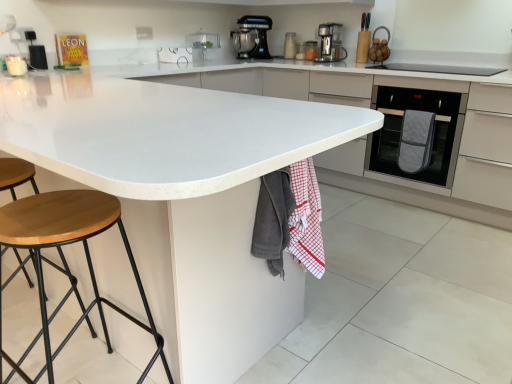
What do you see at coordinates (379, 47) in the screenshot?
I see `wooden fruit basket at upper right, the third appliance from the back` at bounding box center [379, 47].

Where is `black plastic speaker at upper left, the fourth appliance when ordered from right to left`? The image size is (512, 384). black plastic speaker at upper left, the fourth appliance when ordered from right to left is located at coordinates (38, 57).

You are a GUI agent. You are given a task and a screenshot of the screen. Output one action in this format:
    pyautogui.click(x=<x>, y=<y>)
    Task: Click on the wooden fruit basket at upper right, the third appliance from the back
    This screenshot has width=512, height=384.
    Given the screenshot: What is the action you would take?
    pyautogui.click(x=379, y=47)

Is matte white oven at right with matte glass jars at upper center, marked as the second appliance in a left-to-right arrangement?

No, matte white oven at right is not making contact with matte glass jars at upper center, marked as the second appliance in a left-to-right arrangement.

Which is in front, point (273, 78) or point (293, 42)?

The point (273, 78) is closer.

Can you confirm if matte white oven at right is wider than matte glass jars at upper center, marked as the second appliance in a left-to-right arrangement?

Correct, the width of matte white oven at right exceeds that of matte glass jars at upper center, marked as the second appliance in a left-to-right arrangement.

Looking at the image, does black plastic speaker at upper left, which ranks as the 1th appliance in left-to-right order, seem bigger or smaller compared to matte glass jars at upper center, which is the 4th appliance in front-to-back order?

Clearly, black plastic speaker at upper left, which ranks as the 1th appliance in left-to-right order, is smaller in size than matte glass jars at upper center, which is the 4th appliance in front-to-back order.

Is matte glass jars at upper center, which is the 4th appliance in front-to-back order, a part of black plastic speaker at upper left, positioned as the 4th appliance in back-to-front order?

That's incorrect, matte glass jars at upper center, which is the 4th appliance in front-to-back order, is not inside black plastic speaker at upper left, positioned as the 4th appliance in back-to-front order.

From a real-world perspective, is black plastic speaker at upper left, positioned as the 4th appliance in back-to-front order, physically located above or below matte glass jars at upper center, the 3th appliance positioned from the right?

Clearly, from a real-world perspective, black plastic speaker at upper left, positioned as the 4th appliance in back-to-front order, is below matte glass jars at upper center, the 3th appliance positioned from the right.

How many degrees apart are the facing directions of black plastic speaker at upper left, the fourth appliance when ordered from right to left, and matte glass jars at upper center, the 3th appliance positioned from the right?

They differ by 87.8 degrees in their facing directions.

Considering the sizes of quilted gray oven mitt at right and wooden fruit basket at upper right, the third appliance from the back, in the image, is quilted gray oven mitt at right taller or shorter than wooden fruit basket at upper right, the third appliance from the back,?

Considering their sizes, quilted gray oven mitt at right has more height than wooden fruit basket at upper right, the third appliance from the back.

Is quilted gray oven mitt at right positioned with its back to wooden fruit basket at upper right, the 1th appliance viewed from the right?

quilted gray oven mitt at right is not turned away from wooden fruit basket at upper right, the 1th appliance viewed from the right.

There is a quilted gray oven mitt at right. At what (x,y) coordinates should I click in order to perform the action: click on the 2nd appliance above it (from the image's perspective). Please return your answer as a coordinate pair (x, y). Looking at the image, I should click on (379, 47).

What's the angular difference between quilted gray oven mitt at right and wooden fruit basket at upper right, the third appliance from the back,'s facing directions?

quilted gray oven mitt at right and wooden fruit basket at upper right, the third appliance from the back, are facing 1.19 degrees away from each other.

Identify the location of the 2nd appliance located beneath the metallic black stand mixer at upper center, marked as the first kitchen appliance in a back-to-front arrangement (from a real-world perspective). Image resolution: width=512 pixels, height=384 pixels. (290, 45).

Is matte glass jars at upper center, placed as the first appliance when sorted from back to front, outside of metallic black stand mixer at upper center, marked as the first kitchen appliance in a back-to-front arrangement?

Yes, matte glass jars at upper center, placed as the first appliance when sorted from back to front, is located beyond the bounds of metallic black stand mixer at upper center, marked as the first kitchen appliance in a back-to-front arrangement.

Is matte glass jars at upper center, which is the 4th appliance in front-to-back order, next to metallic black stand mixer at upper center, the 1th kitchen appliance when ordered from left to right?

No, matte glass jars at upper center, which is the 4th appliance in front-to-back order, is not touching metallic black stand mixer at upper center, the 1th kitchen appliance when ordered from left to right.

How far apart are matte glass jars at upper center, which is the 4th appliance in front-to-back order, and metallic black stand mixer at upper center, the 1th kitchen appliance when ordered from left to right?

12.48 inches.

Is quilted gray oven mitt at right at the back of wooden seat stool at lower left?

wooden seat stool at lower left does not have its back to quilted gray oven mitt at right.

Is point (46, 231) behind point (433, 191)?

No, it is in front of (433, 191).

Looking at the image, does wooden seat stool at lower left seem bigger or smaller compared to quilted gray oven mitt at right?

Clearly, wooden seat stool at lower left is smaller in size than quilted gray oven mitt at right.

From the image's perspective, which is below, quilted gray oven mitt at right or red checkered towel at lower center, the second blanket viewed from the left?

red checkered towel at lower center, the second blanket viewed from the left.

Can you confirm if quilted gray oven mitt at right is positioned to the left of red checkered towel at lower center, which is counted as the second blanket, starting from the back?

Incorrect, quilted gray oven mitt at right is not on the left side of red checkered towel at lower center, which is counted as the second blanket, starting from the back.

Looking at this image, considering the positions of objects quilted gray oven mitt at right and red checkered towel at lower center, the second blanket viewed from the left, in the image provided, who is in front, quilted gray oven mitt at right or red checkered towel at lower center, the second blanket viewed from the left,?

red checkered towel at lower center, the second blanket viewed from the left, is in front.

Does quilted gray oven mitt at right have a lesser width compared to red checkered towel at lower center, the second blanket viewed from the left?

In fact, quilted gray oven mitt at right might be wider than red checkered towel at lower center, the second blanket viewed from the left.

From the image's perspective, is quilted gray oven mitt at right under black plastic speaker at upper left, placed as the 1th appliance when sorted from front to back?

Yes, from the image's perspective, quilted gray oven mitt at right is below black plastic speaker at upper left, placed as the 1th appliance when sorted from front to back.

Is quilted gray oven mitt at right completely or partially outside of black plastic speaker at upper left, which ranks as the 1th appliance in left-to-right order?

Yes.

Locate an element on the screen. The width and height of the screenshot is (512, 384). cabinetry located underneath the matte glass jars at upper center, placed as the first appliance when sorted from back to front (from a real-world perspective) is located at coordinates (377, 140).

From the image's perspective, count 3rd appliances downward from the matte glass jars at upper center, marked as the second appliance in a left-to-right arrangement, and point to it. Please provide its 2D coordinates.

[(38, 57)]

Considering their positions, is matte glass jars at upper center, marked as the second appliance in a left-to-right arrangement, positioned closer to red checkered towel at lower center, which is the 2th blanket from front to back, than wooden fruit basket at upper right, acting as the 4th appliance starting from the left?

Among the two, wooden fruit basket at upper right, acting as the 4th appliance starting from the left, is located nearer to red checkered towel at lower center, which is the 2th blanket from front to back.

Based on their spatial positions, is translucent glass jar at upper center, placed as the third appliance when sorted from left to right, or red checkered towel at lower center, which is the 2th blanket from front to back, further from satin black coffee machine at upper center, acting as the 1th kitchen appliance starting from the front?

red checkered towel at lower center, which is the 2th blanket from front to back.

From the image, which object appears to be nearer to matte glass jars at upper center, the 3th appliance positioned from the right, satin black coffee machine at upper center, which ranks as the 2th kitchen appliance in left-to-right order, or matte white oven at right?

The object closer to matte glass jars at upper center, the 3th appliance positioned from the right, is satin black coffee machine at upper center, which ranks as the 2th kitchen appliance in left-to-right order.

From the image, which object appears to be nearer to matte glass jars at upper center, which is the 4th appliance in front-to-back order, quilted fabric oven mitt at right, placed as the 1th blanket when sorted from back to front, or matte white oven at right?

matte white oven at right is positioned closer to the anchor matte glass jars at upper center, which is the 4th appliance in front-to-back order.

From the image, which object appears to be farther from wooden seat stool at lower left, quilted fabric oven mitt at right, the 3th blanket positioned from the left, or translucent glass jar at upper center, which ranks as the 3th appliance in front-to-back order?

translucent glass jar at upper center, which ranks as the 3th appliance in front-to-back order, is positioned further to the anchor wooden seat stool at lower left.

Estimate the real-world distances between objects in this image. Which object is further from matte white oven at right, satin black coffee machine at upper center, which ranks as the 2th kitchen appliance in left-to-right order, or gray cotton towel at lower center, which appears as the 1th blanket when viewed from the front?

Among the two, gray cotton towel at lower center, which appears as the 1th blanket when viewed from the front, is located further to matte white oven at right.

Based on their spatial positions, is quilted fabric oven mitt at right, the 3th blanket positioned from the left, or matte glass jars at upper center, marked as the second appliance in a left-to-right arrangement, further from quilted gray oven mitt at right?

Among the two, matte glass jars at upper center, marked as the second appliance in a left-to-right arrangement, is located further to quilted gray oven mitt at right.

Estimate the real-world distances between objects in this image. Which object is closer to translucent glass jar at upper center, which ranks as the 3th appliance in front-to-back order, matte glass jars at upper center, which is the 4th appliance in front-to-back order, or quilted gray oven mitt at right?

matte glass jars at upper center, which is the 4th appliance in front-to-back order, lies closer to translucent glass jar at upper center, which ranks as the 3th appliance in front-to-back order, than the other object.

In order to click on cabinetry between red checkered towel at lower center, which is counted as the second blanket, starting from the back, and satin black coffee machine at upper center, which is the 2th kitchen appliance in back-to-front order, along the z-axis in this screenshot , I will do `click(377, 140)`.

In order to click on blanket between matte white oven at right and metallic black stand mixer at upper center, marked as the second kitchen appliance in a front-to-back arrangement, from front to back in this screenshot , I will do `click(416, 141)`.

This screenshot has height=384, width=512. In order to click on kitchen appliance that lies between translucent glass jar at upper center, placed as the third appliance when sorted from left to right, and quilted fabric oven mitt at right, placed as the 1th blanket when sorted from right to left, from top to bottom in this screenshot , I will do `click(330, 43)`.

The image size is (512, 384). I want to click on home appliance between wooden seat stool at lower left and matte glass jars at upper center, marked as the second appliance in a left-to-right arrangement, from front to back, so click(x=417, y=132).